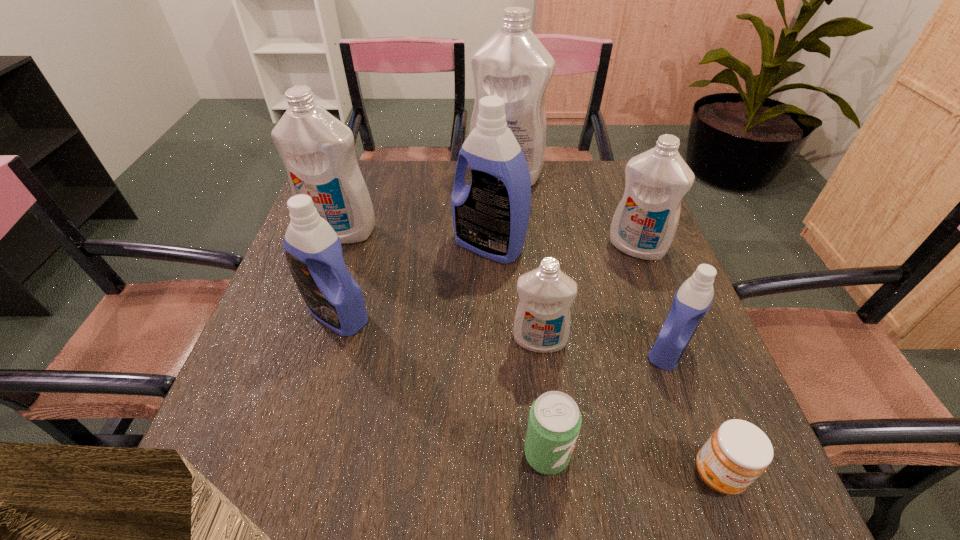
Locate an element on the screen. Image resolution: width=960 pixels, height=540 pixels. the farthest white detergent is located at coordinates (513, 64).

Locate an element on the screen. the farthest object is located at coordinates (513, 64).

Find the location of a particular element. the third smallest white detergent is located at coordinates (317, 149).

The image size is (960, 540). In order to click on the biggest blue detergent in this screenshot , I will do `click(490, 217)`.

Locate an element on the screen. This screenshot has width=960, height=540. the second blue detergent from left to right is located at coordinates (490, 217).

Locate an element on the screen. This screenshot has height=540, width=960. the rightmost white detergent is located at coordinates (645, 222).

This screenshot has width=960, height=540. Identify the location of the second smallest blue detergent. (313, 251).

Locate an element on the screen. The height and width of the screenshot is (540, 960). the nearest white detergent is located at coordinates (542, 320).

This screenshot has width=960, height=540. Identify the location of the rightmost blue detergent. (694, 297).

Where is `the eighth tallest object`? This screenshot has width=960, height=540. the eighth tallest object is located at coordinates (554, 423).